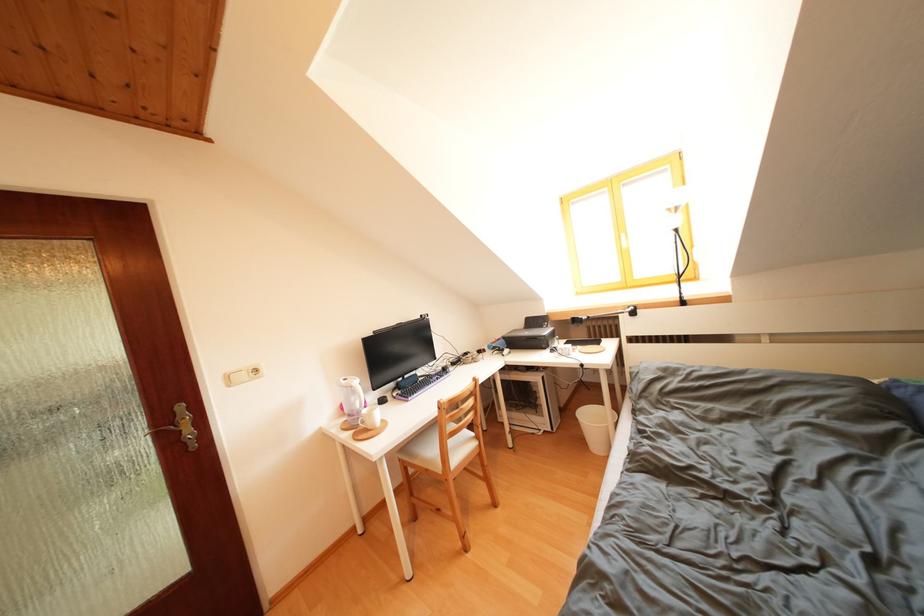
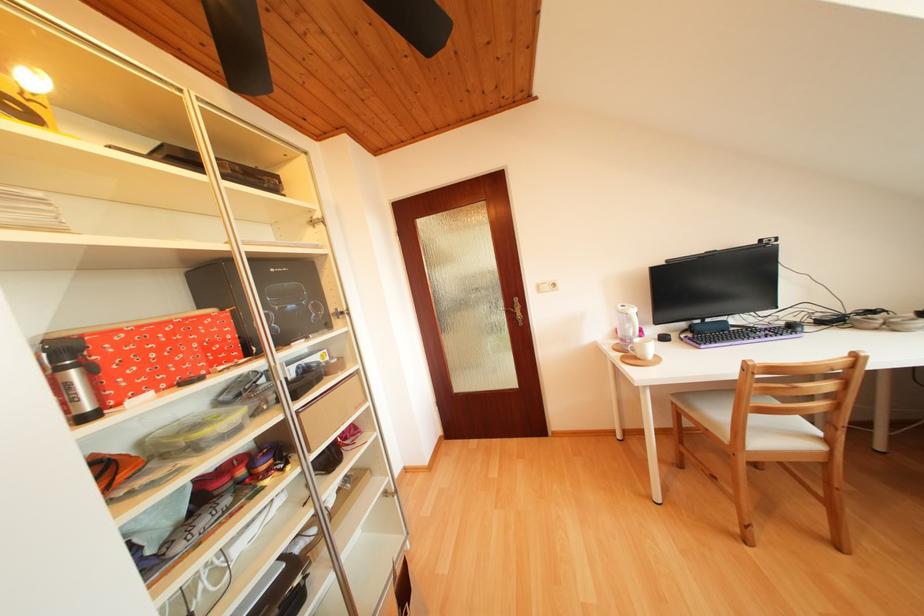
In the second image, find the point that corresponds to pixel 430 321 in the first image.

(769, 246)